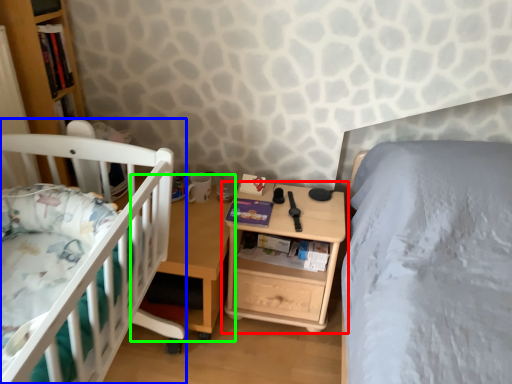
Question: Estimate the real-world distances between objects in this image. Which object is closer to nightstand (highlighted by a red box), infant bed (highlighted by a blue box) or table (highlighted by a green box)?

Choices:
 (A) infant bed
 (B) table

Answer: (B)